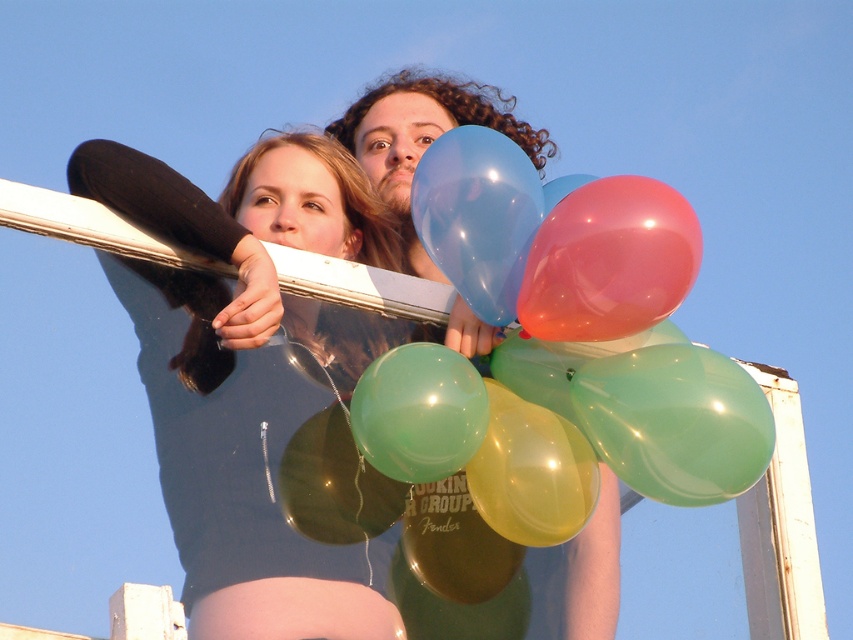
Looking at this image, is matte black hoodie at upper left further to the viewer compared to translucent glossy balloon at upper center?

That is False.

At what (x,y) coordinates should I click in order to perform the action: click on matte black hoodie at upper left. Please return your answer as a coordinate pair (x, y). Looking at the image, I should click on (254, 348).

Which of these two, matte black hoodie at upper left or smooth black hair at upper center, stands taller?

With more height is smooth black hair at upper center.

Is matte black hoodie at upper left wider than smooth black hair at upper center?

No.

Between point (196, 337) and point (271, 307), which one is positioned in front?

Positioned in front is point (271, 307).

Where is `matte black hoodie at upper left`? matte black hoodie at upper left is located at coordinates (254, 348).

Is translucent glossy balloons at upper center shorter than matte black hoodie at upper left?

Yes, translucent glossy balloons at upper center is shorter than matte black hoodie at upper left.

Does translucent glossy balloons at upper center appear under matte black hoodie at upper left?

Correct, translucent glossy balloons at upper center is located below matte black hoodie at upper left.

At what (x,y) coordinates should I click in order to perform the action: click on translucent glossy balloons at upper center. Please return your answer as a coordinate pair (x, y). Looking at the image, I should click on (595, 312).